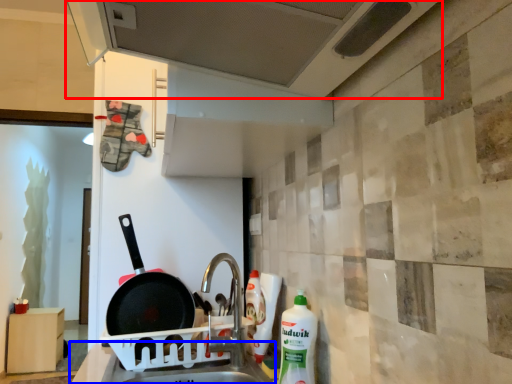
Question: Which object is closer to the camera taking this photo, exhaust hood (highlighted by a red box) or counter top (highlighted by a blue box)?

Choices:
 (A) exhaust hood
 (B) counter top

Answer: (A)